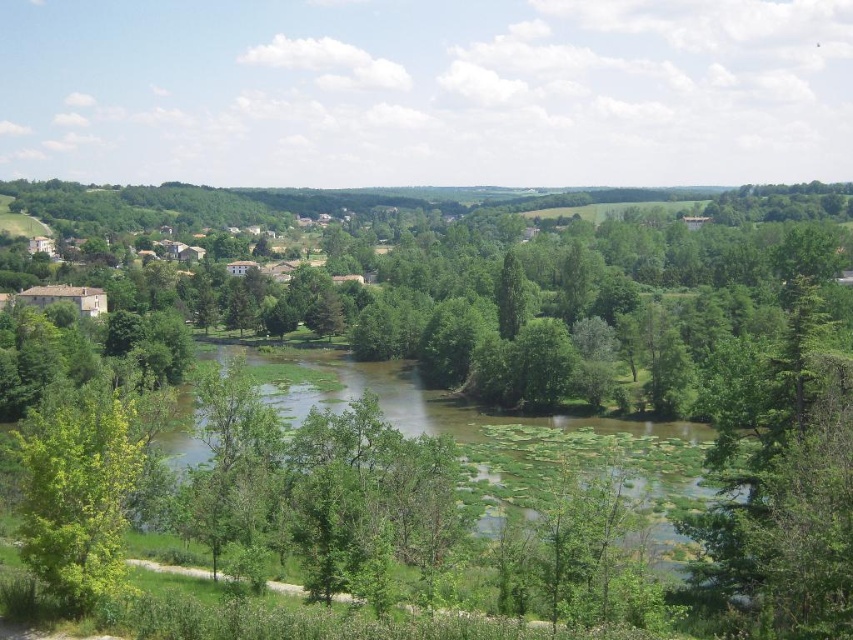
You are standing at the point with coordinates point (122, 508) and want to look towards the point with coordinates point (674, 497). Which direction should you face?

Since point (674, 497) is behind point (122, 508), you should face north to look towards point (674, 497) from point (122, 508).